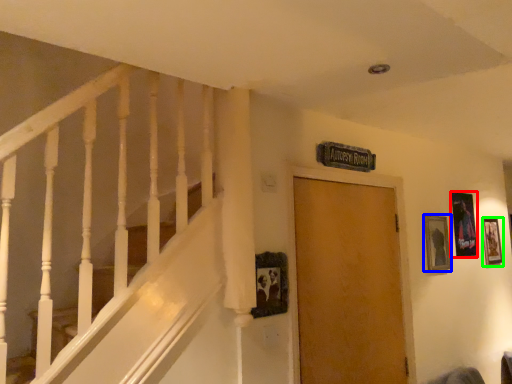
Question: Based on their relative distances, which object is farther from picture frame (highlighted by a red box)? Choose from picture frame (highlighted by a blue box) and picture frame (highlighted by a green box).

Choices:
 (A) picture frame
 (B) picture frame

Answer: (B)